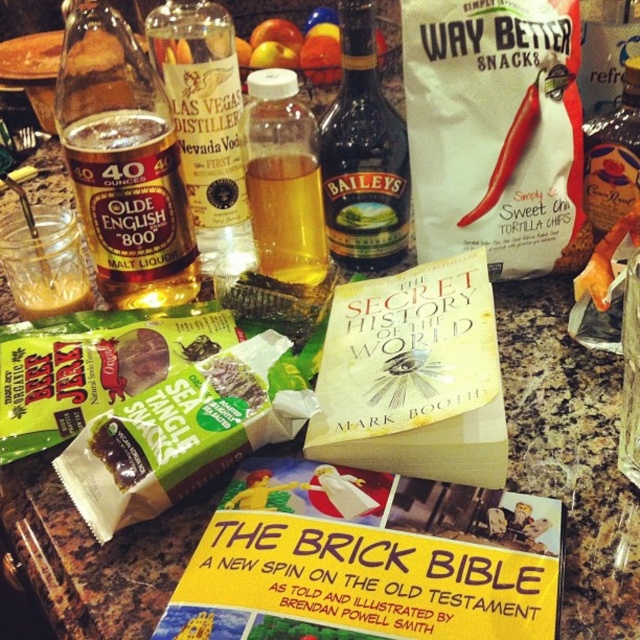
Does dark brown glass bottle at center have a smaller size compared to translucent plastic bottle at center?

Actually, dark brown glass bottle at center might be larger than translucent plastic bottle at center.

Is dark brown glass bottle at center in front of translucent plastic bottle at center?

No, dark brown glass bottle at center is behind translucent plastic bottle at center.

This screenshot has width=640, height=640. Describe the element at coordinates (364, 156) in the screenshot. I see `dark brown glass bottle at center` at that location.

This screenshot has width=640, height=640. In order to click on dark brown glass bottle at center in this screenshot , I will do `click(364, 156)`.

Which is in front, point (160, 72) or point (612, 145)?

Point (612, 145) is in front.

Is clear glass nevada vodka bottle at center to the left of gold glass bottle at center from the viewer's perspective?

Correct, you'll find clear glass nevada vodka bottle at center to the left of gold glass bottle at center.

Which is in front, point (204, 93) or point (593, 196)?

Point (204, 93) is more forward.

Where is `clear glass nevada vodka bottle at center`? The width and height of the screenshot is (640, 640). clear glass nevada vodka bottle at center is located at coordinates (205, 124).

Who is lower down, clear glass nevada vodka bottle at center or translucent plastic bottle at center?

Positioned lower is translucent plastic bottle at center.

Based on the photo, can you confirm if clear glass nevada vodka bottle at center is taller than translucent plastic bottle at center?

Correct, clear glass nevada vodka bottle at center is much taller as translucent plastic bottle at center.

Between point (225, 170) and point (312, 163), which one is positioned in front?

Point (312, 163) is more forward.

Identify the location of clear glass nevada vodka bottle at center. Image resolution: width=640 pixels, height=640 pixels. (205, 124).